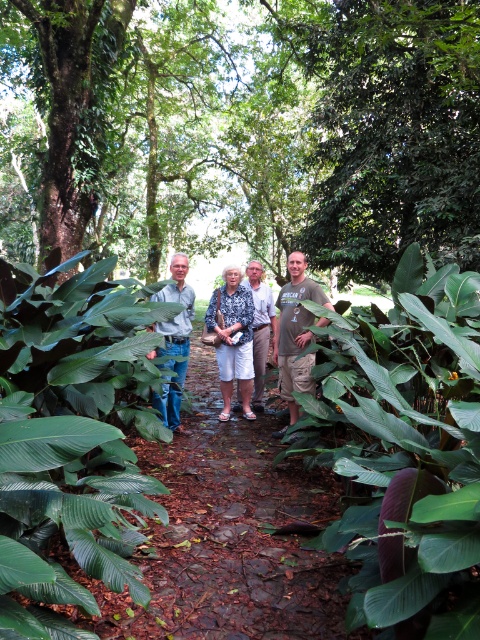
Is green leafy plant at center positioned behind white cotton shorts at center?

That is False.

Between green leafy plant at center and white cotton shorts at center, which one has more height?

white cotton shorts at center

Measure the distance between green leafy plant at center and camera.

green leafy plant at center and camera are 2.89 meters apart.

You are a GUI agent. You are given a task and a screenshot of the screen. Output one action in this format:
    pyautogui.click(x=<x>, y=<y>)
    Task: Click on the green leafy plant at center
    
    Given the screenshot: What is the action you would take?
    pyautogui.click(x=71, y=440)

Between green leafy plant at center and printed fabric blouse at center, which one has more height?

printed fabric blouse at center is taller.

From the picture: Who is positioned more to the right, green leafy plant at center or printed fabric blouse at center?

printed fabric blouse at center

In order to click on green leafy plant at center in this screenshot , I will do `click(71, 440)`.

How far apart are green leafy tree at center and green rough bark tree at upper left?

They are 14.14 meters apart.

Is point (282, 180) closer to viewer compared to point (41, 177)?

That is False.

Locate an element on the screen. green leafy tree at center is located at coordinates (240, 131).